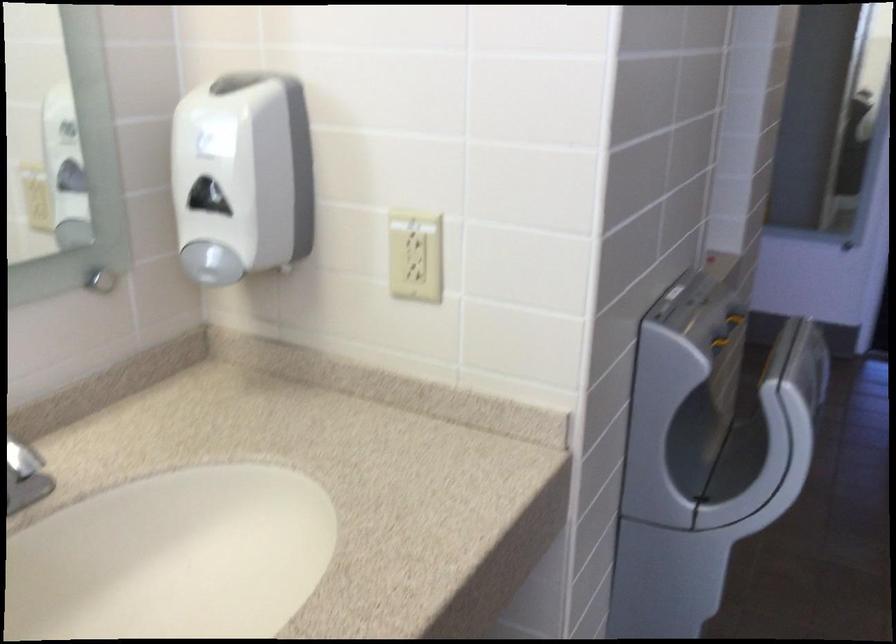
Locate an element on the screen. The height and width of the screenshot is (644, 896). hand dryer slot is located at coordinates (211, 263).